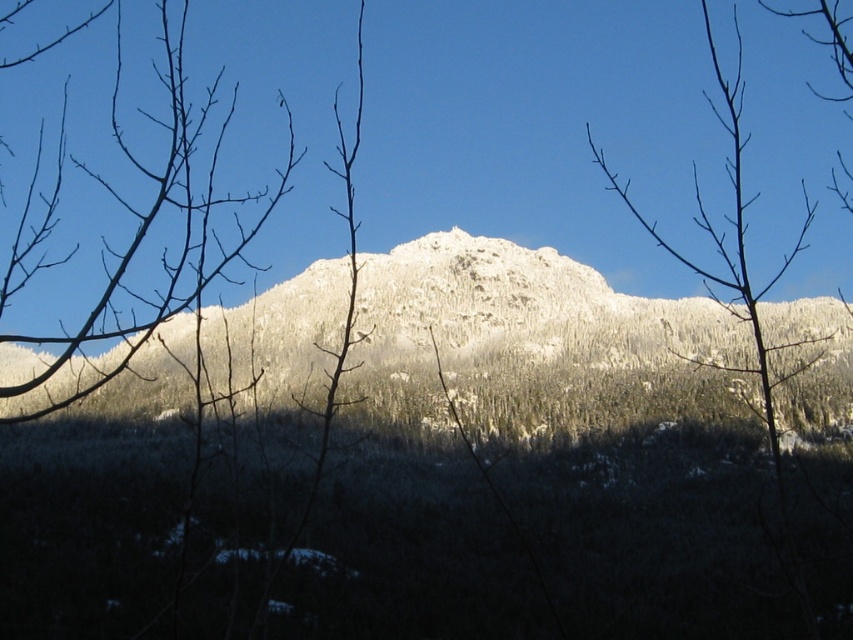
Question: Is white frosty mountain at center thinner than smooth bark tree at center?

Choices:
 (A) no
 (B) yes

Answer: (A)

Question: Does white frosty mountain at center appear on the left side of smooth bark tree at center?

Choices:
 (A) yes
 (B) no

Answer: (A)

Question: Does white frosty mountain at center lie behind smooth bark tree at center?

Choices:
 (A) yes
 (B) no

Answer: (A)

Question: Which of the following is the farthest from the observer?

Choices:
 (A) smooth bark tree at center
 (B) white frosty mountain at center

Answer: (B)